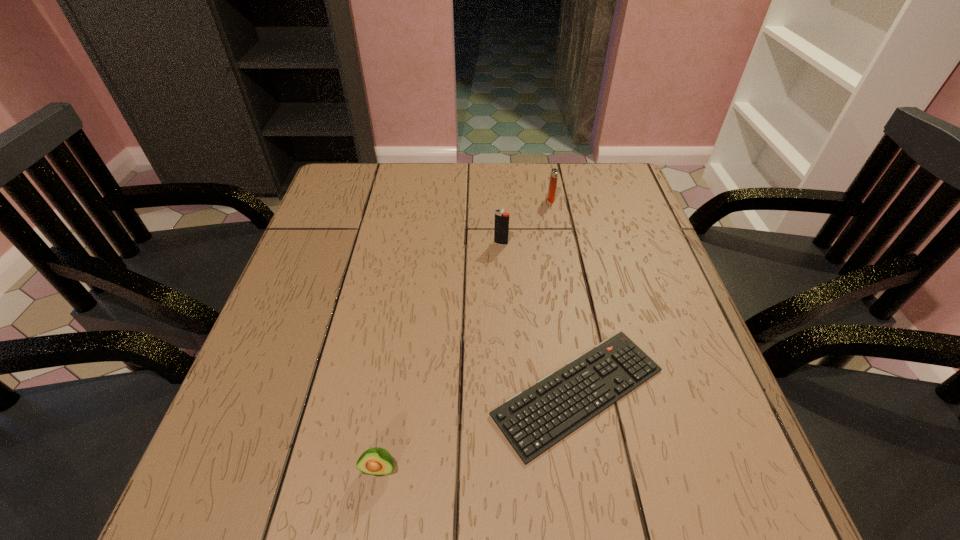
Where is `vacant space located 0.100m on the left of the shortest object`? Image resolution: width=960 pixels, height=540 pixels. vacant space located 0.100m on the left of the shortest object is located at coordinates (435, 392).

The width and height of the screenshot is (960, 540). I want to click on object that is positioned at the far edge, so click(554, 172).

Image resolution: width=960 pixels, height=540 pixels. In order to click on avocado at the near edge in this screenshot , I will do `click(376, 461)`.

Locate an element on the screen. computer keyboard situated at the near edge is located at coordinates (533, 421).

Find the location of `object positioned at the right edge`. object positioned at the right edge is located at coordinates (533, 421).

Locate an element on the screen. This screenshot has width=960, height=540. object that is at the near right corner is located at coordinates (533, 421).

I want to click on vacant space at the far edge, so click(x=567, y=196).

The image size is (960, 540). Identify the location of vacant region at the near edge of the desktop. (495, 516).

Where is `free region at the left edge`? free region at the left edge is located at coordinates (329, 263).

The height and width of the screenshot is (540, 960). Identify the location of free point at the right edge. (652, 271).